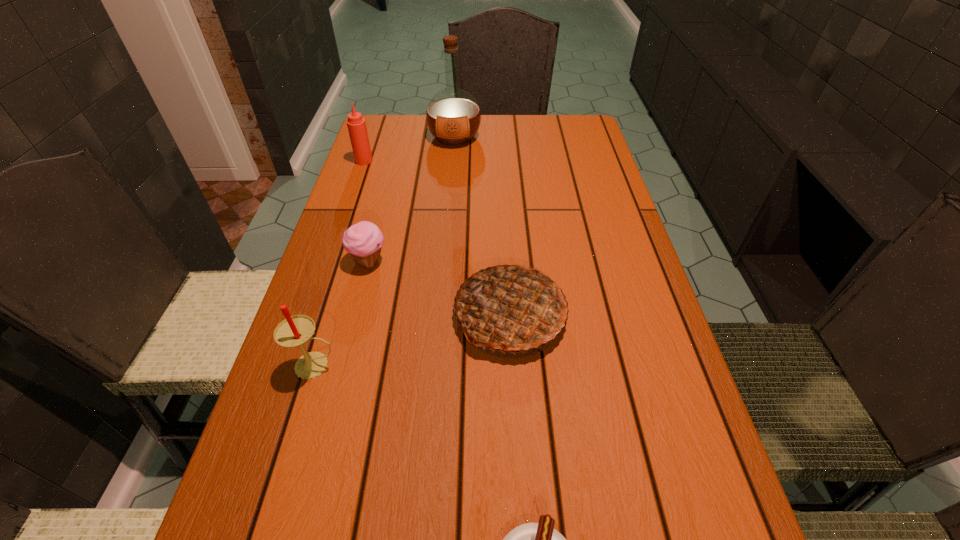
Where is `vacant region located 0.260m on the right of the candle`? vacant region located 0.260m on the right of the candle is located at coordinates (477, 365).

I want to click on vacant space located on the right of the cupcake, so click(x=535, y=261).

This screenshot has width=960, height=540. Identify the location of object present at the far edge. (453, 116).

Image resolution: width=960 pixels, height=540 pixels. I want to click on Tabasco sauce that is positioned at the left edge, so (x=356, y=124).

Find the location of a particular element. The image size is (960, 540). candle present at the left edge is located at coordinates (294, 331).

The image size is (960, 540). Find the location of `cupcake that is at the left edge`. cupcake that is at the left edge is located at coordinates (364, 240).

The height and width of the screenshot is (540, 960). Identify the location of free space at the far edge. (425, 130).

Locate an element on the screen. The width and height of the screenshot is (960, 540). vacant space at the left edge of the desktop is located at coordinates (349, 419).

This screenshot has width=960, height=540. I want to click on vacant space at the right edge, so click(640, 392).

The image size is (960, 540). I want to click on blank area at the far left corner, so click(405, 143).